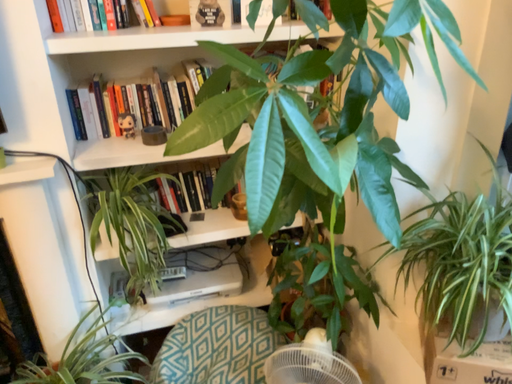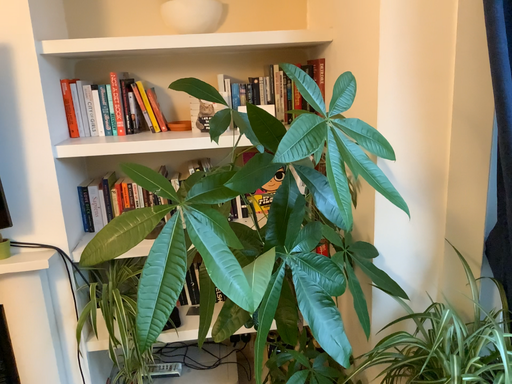
Question: How did the camera likely rotate when shooting the video?

Choices:
 (A) rotated downward
 (B) rotated upward

Answer: (B)